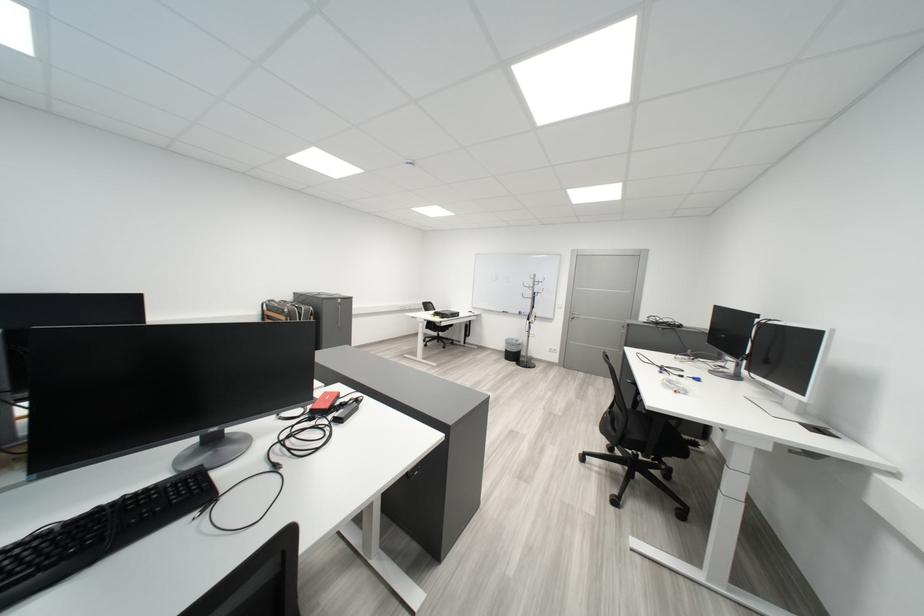
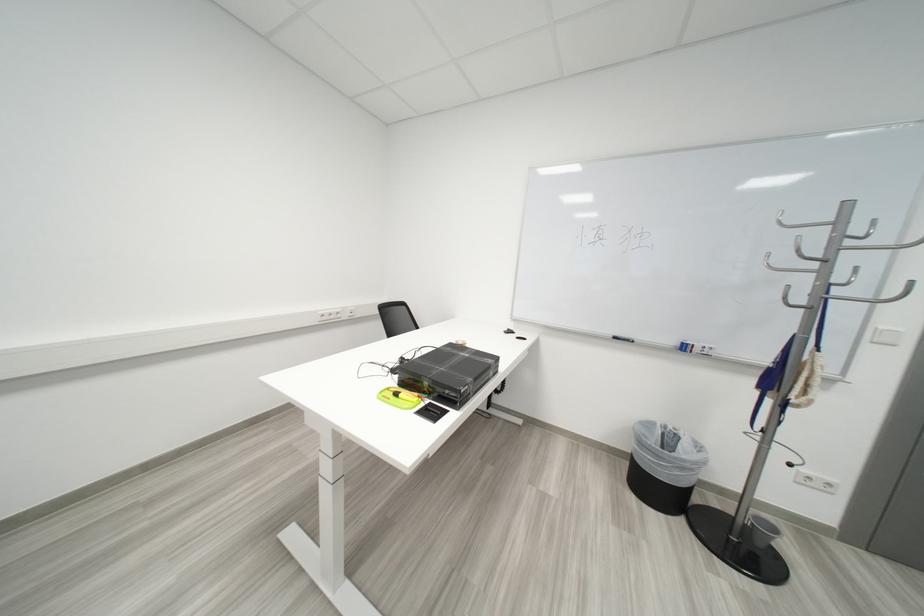
The point at (533, 315) is marked in the first image. Where is the corresponding point in the second image?

(698, 350)